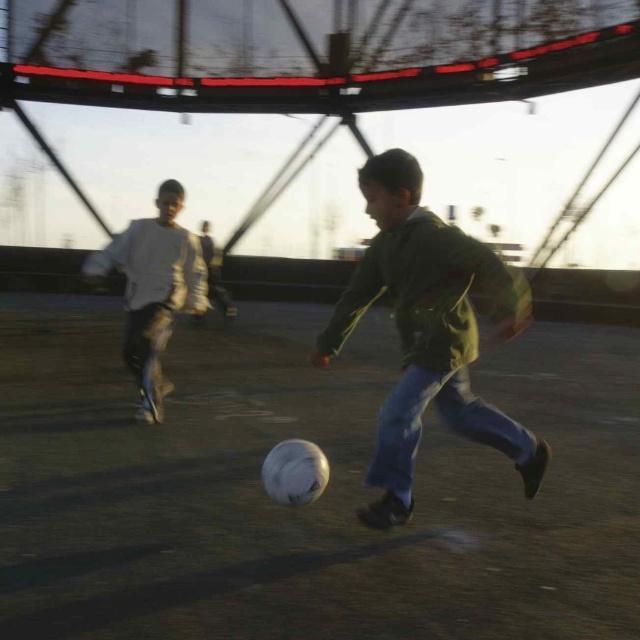
Question: Can you confirm if green matte jacket at center is positioned to the left of white matte shirt at left?

Choices:
 (A) yes
 (B) no

Answer: (B)

Question: Which object appears closest to the camera in this image?

Choices:
 (A) white matte shirt at left
 (B) green matte jacket at center

Answer: (B)

Question: Which point is farther from the camera taking this photo?

Choices:
 (A) (400, 428)
 (B) (157, 392)

Answer: (B)

Question: Can you confirm if green matte jacket at center is positioned to the right of white matte shirt at left?

Choices:
 (A) yes
 (B) no

Answer: (A)

Question: Can you confirm if green matte jacket at center is positioned above white matte shirt at left?

Choices:
 (A) no
 (B) yes

Answer: (A)

Question: Which point appears closest to the camera in this image?

Choices:
 (A) (152, 289)
 (B) (488, 435)

Answer: (B)